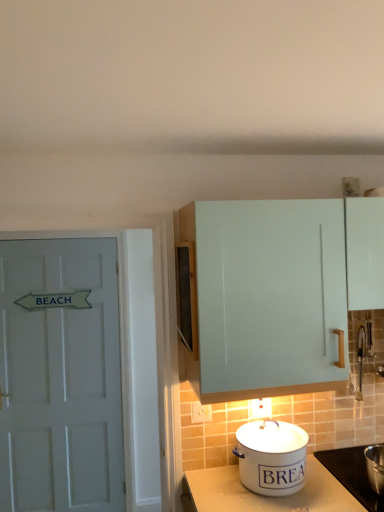
Question: From the image's perspective, is white enamel pot at lower right located beneath light blue matte cabinet at upper right?

Choices:
 (A) yes
 (B) no

Answer: (A)

Question: Is white enamel pot at lower right thinner than light blue matte cabinet at upper right?

Choices:
 (A) no
 (B) yes

Answer: (A)

Question: From a real-world perspective, does white enamel pot at lower right stand above light blue matte cabinet at upper right?

Choices:
 (A) no
 (B) yes

Answer: (A)

Question: From the image's perspective, does white enamel pot at lower right appear higher than light blue matte cabinet at upper right?

Choices:
 (A) yes
 (B) no

Answer: (B)

Question: Is light blue matte cabinet at upper right located within white enamel pot at lower right?

Choices:
 (A) no
 (B) yes

Answer: (A)

Question: Does white enamel pot at lower right have a smaller size compared to light blue matte cabinet at upper right?

Choices:
 (A) yes
 (B) no

Answer: (A)

Question: Is white enamel pot at lower right oriented towards white painted wood door at left?

Choices:
 (A) no
 (B) yes

Answer: (A)

Question: Considering the relative positions of white enamel pot at lower right and white painted wood door at left in the image provided, is white enamel pot at lower right to the right of white painted wood door at left from the viewer's perspective?

Choices:
 (A) no
 (B) yes

Answer: (B)

Question: Does white enamel pot at lower right have a lesser height compared to white painted wood door at left?

Choices:
 (A) no
 (B) yes

Answer: (B)

Question: From the image's perspective, is white enamel pot at lower right on top of white painted wood door at left?

Choices:
 (A) no
 (B) yes

Answer: (A)

Question: Is white enamel pot at lower right next to white painted wood door at left and touching it?

Choices:
 (A) no
 (B) yes

Answer: (A)

Question: Does white enamel pot at lower right appear on the left side of white painted wood door at left?

Choices:
 (A) no
 (B) yes

Answer: (A)

Question: Considering the relative sizes of white painted wood door at left and white enamel bread bin at lower center in the image provided, is white painted wood door at left smaller than white enamel bread bin at lower center?

Choices:
 (A) no
 (B) yes

Answer: (A)